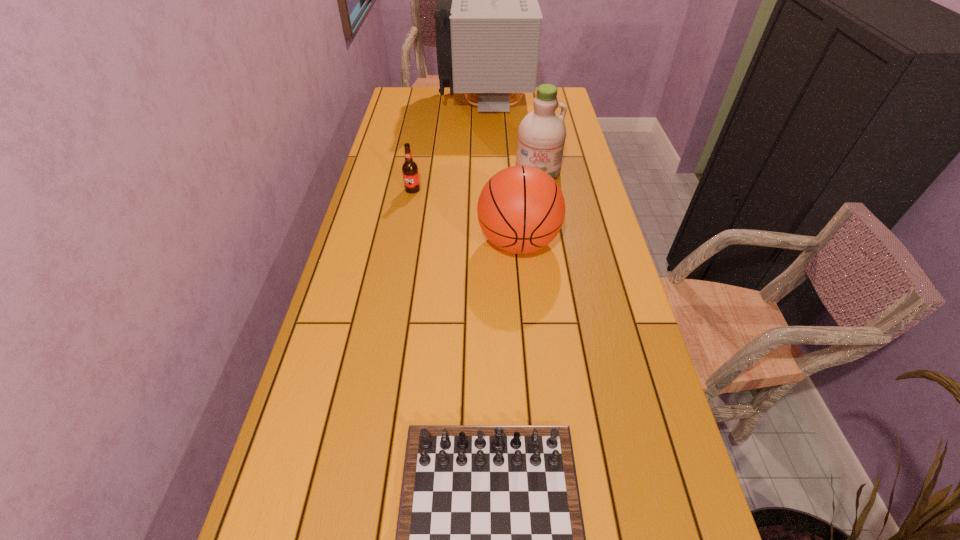
Locate an element on the screen. empty location between the farthest object and the cleansing agent is located at coordinates point(512,138).

Find the location of a particular element. The width and height of the screenshot is (960, 540). free space between the leftmost object and the tallest object is located at coordinates (449, 147).

Where is `free spot between the third farthest object and the third tallest object`? This screenshot has height=540, width=960. free spot between the third farthest object and the third tallest object is located at coordinates 466,217.

Where is `vacant space in between the second shortest object and the tallest object`? vacant space in between the second shortest object and the tallest object is located at coordinates (449, 147).

What are the coordinates of `object identified as the fourth closest to the basketball` in the screenshot? It's located at pos(488,21).

The height and width of the screenshot is (540, 960). Find the location of `object that stands as the fourth closest to the nearest object`. object that stands as the fourth closest to the nearest object is located at coordinates (488, 21).

In order to click on free region that satisfies the following two spatial constraints: 1. on the front side of the third tallest object; 2. on the right side of the leftmost object in this screenshot , I will do `click(403, 243)`.